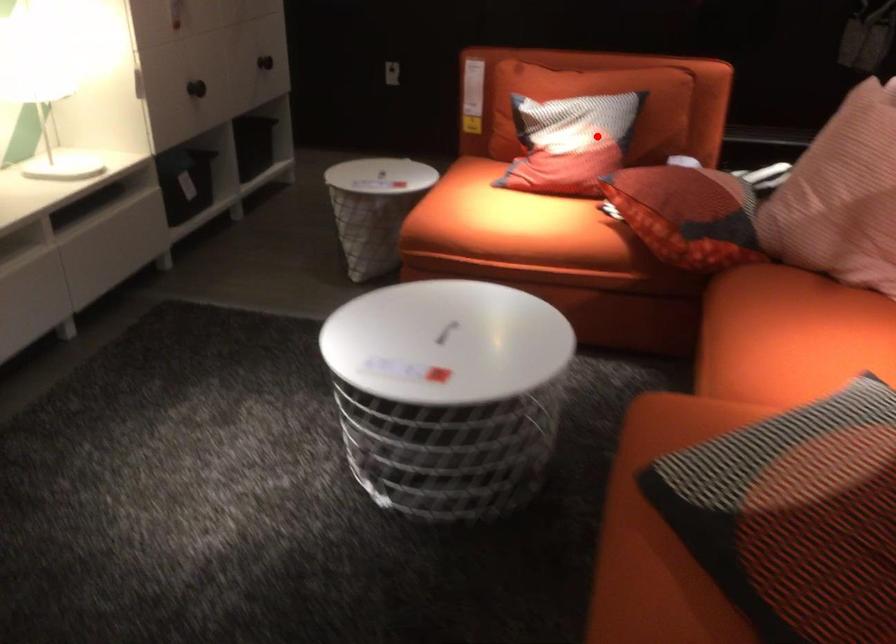
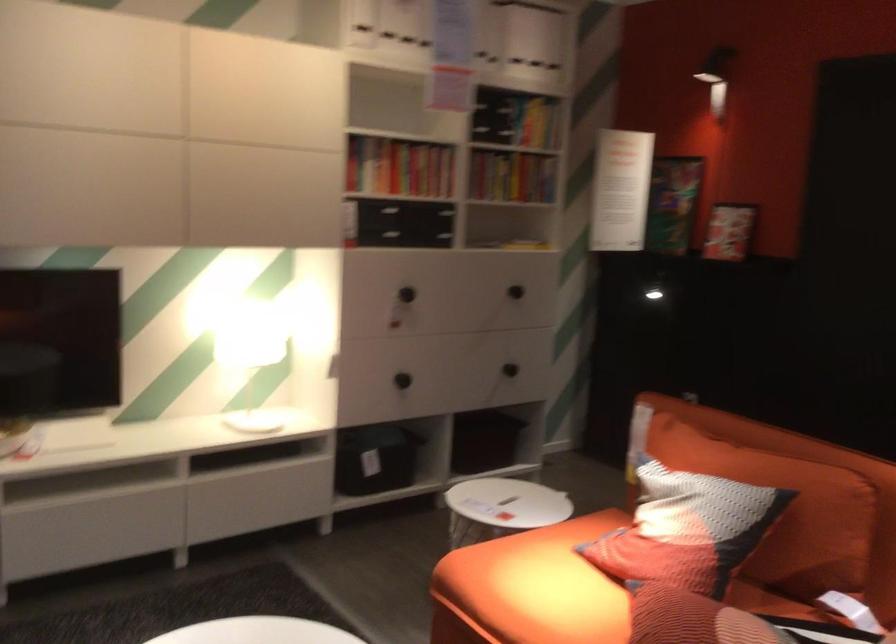
The point at the highlighted location is marked in the first image. Where is the corresponding point in the second image?

(686, 529)